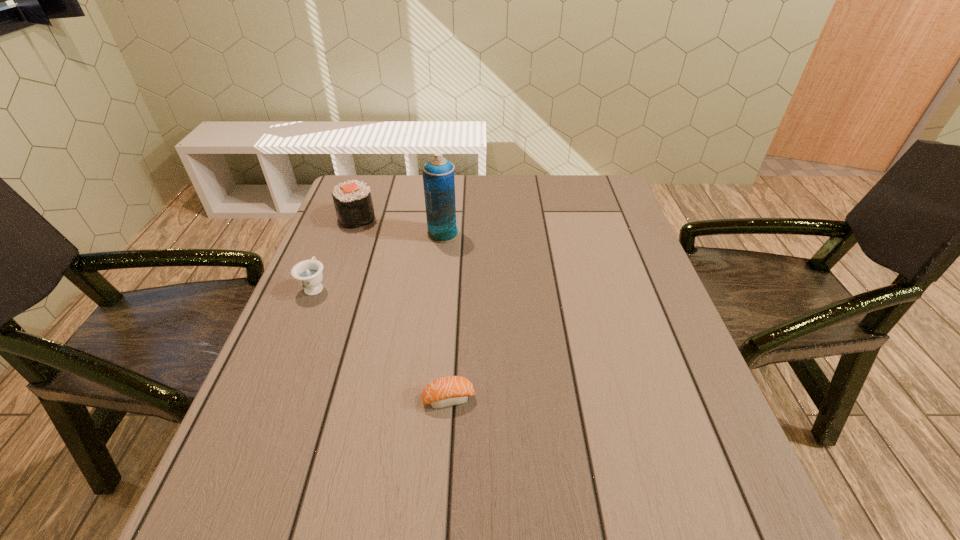
Find the location of a particular element. Image resolution: width=960 pixels, height=540 pixels. the tallest object is located at coordinates (438, 174).

Find the location of `the taller sushi`. the taller sushi is located at coordinates point(353,203).

You are a GUI agent. You are given a task and a screenshot of the screen. Output one action in this format:
    pyautogui.click(x=<x>, y=<y>)
    Task: Click on the farther sushi
    
    Given the screenshot: What is the action you would take?
    pyautogui.click(x=353, y=203)

At what (x,y) coordinates should I click in order to perform the action: click on teacup. Please return your answer as a coordinate pair (x, y). This screenshot has height=540, width=960. Looking at the image, I should click on (308, 273).

This screenshot has width=960, height=540. I want to click on the second nearest object, so click(x=308, y=273).

Where is `the nearer sushi`? the nearer sushi is located at coordinates point(448,391).

Identify the location of the shortest object. (448, 391).

Identify the location of free region located on the right of the aerosol can. (488, 234).

Identify the location of blank space located on the right of the left sushi. (441, 218).

This screenshot has width=960, height=540. Find the location of `vacant space located on the side of the teacup with the handle`. vacant space located on the side of the teacup with the handle is located at coordinates (329, 251).